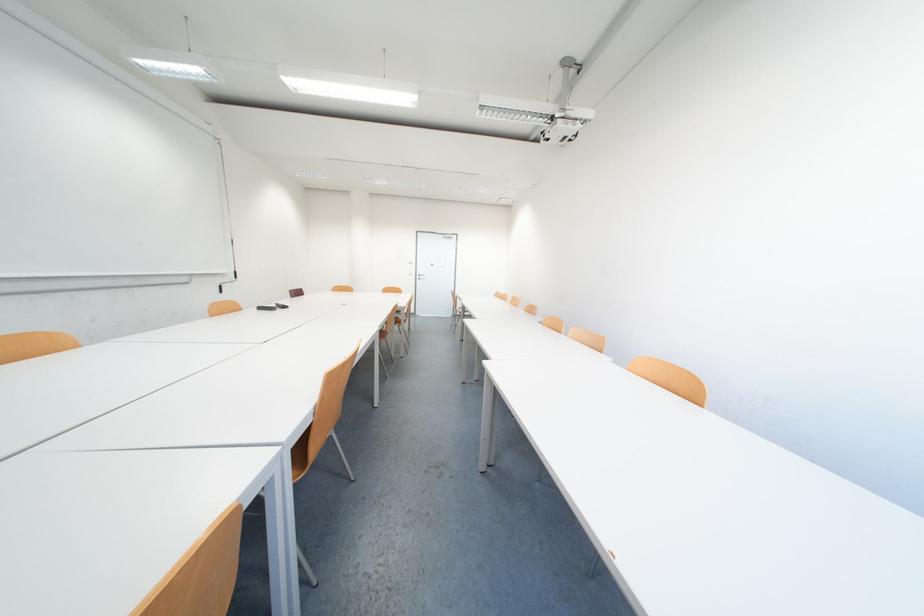
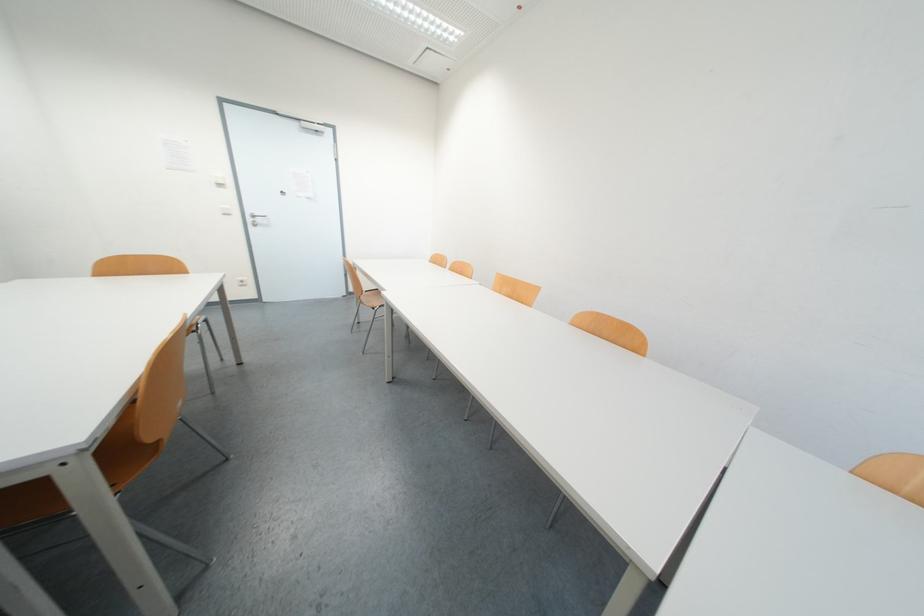
Question: The images are taken continuously from a first-person perspective. In which direction are you moving?

Choices:
 (A) Left
 (B) Right
 (C) Forward
 (D) Backward

Answer: (C)